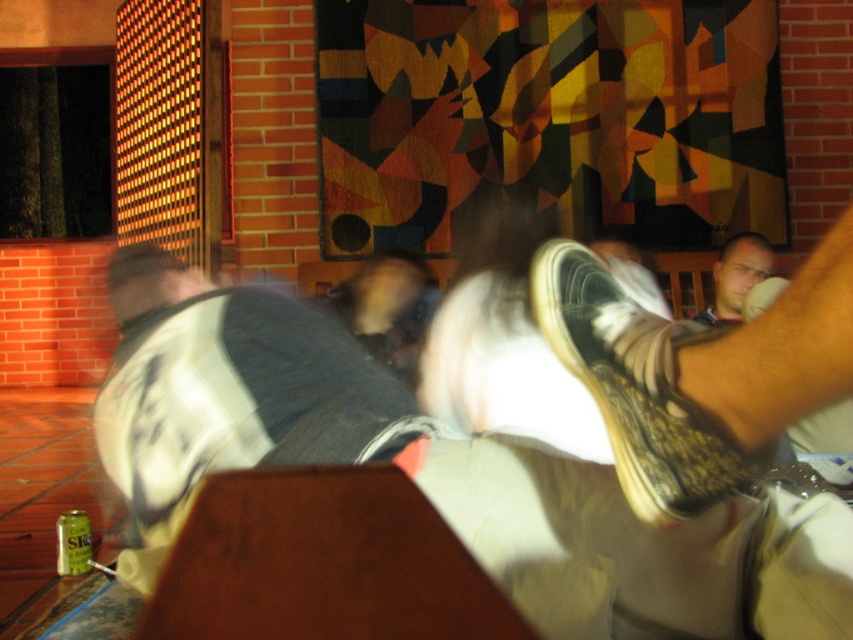
You are a photographer trying to capture a candid shot of the person in the scene. You notice the white cotton shirt at upper center and the smooth skin face at upper right. Which object should you focus on first if you want to ensure both are in focus without adjusting the camera settings?

The white cotton shirt at upper center should be focused on first because it is taller than the smooth skin face at upper right, so focusing on the farther object first would help ensure both are in focus.

You are a photographer trying to capture both the white cotton shirt at upper center and the worn leather shoe at lower right in a single frame. Given their sizes, which object would you need to move closer to the camera to ensure both appear equally sized in the photo?

Since the white cotton shirt at upper center is larger in size than the worn leather shoe at lower right, you would need to move the worn leather shoe at lower right closer to the camera to make them appear the same size in the photo.

You are a photographer trying to capture the worn leather shoe at lower right and the smooth skin face at upper right in a single frame. Since the camera can only focus on one subject at a time, which object should you focus on to ensure it appears sharp in the photo?

The worn leather shoe at lower right is in front of the smooth skin face at upper right, so focusing on the worn leather shoe at lower right will ensure it appears sharp while the background subject may be slightly blurred.